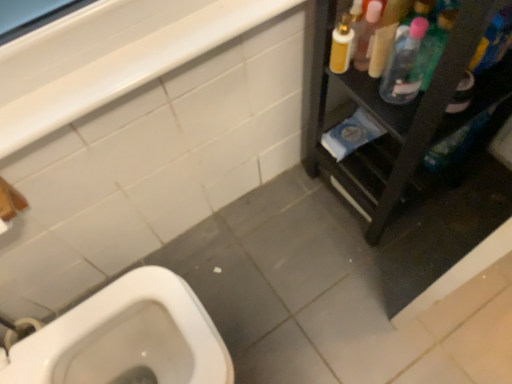
Image resolution: width=512 pixels, height=384 pixels. I want to click on white glossy balustrade at upper left, so click(x=129, y=69).

The height and width of the screenshot is (384, 512). What do you see at coordinates (405, 117) in the screenshot? I see `black plastic shelf at right` at bounding box center [405, 117].

This screenshot has width=512, height=384. I want to click on clear plastic bottle at upper right, acting as the second cleaning product starting from the right, so click(x=405, y=65).

Image resolution: width=512 pixels, height=384 pixels. I want to click on white glossy balustrade at upper left, so click(x=129, y=69).

Find the location of a particular element. furniture that is under the white glossy balustrade at upper left (from a real-world perspective) is located at coordinates (405, 117).

From a real-world perspective, is white glossy balustrade at upper left physically below black plastic shelf at right?

No, from a real-world perspective, white glossy balustrade at upper left is not beneath black plastic shelf at right.

Which is closer, [146,45] or [353,155]?

Point [146,45] appears to be closer to the viewer than point [353,155].

Considering the relative sizes of white glossy balustrade at upper left and black plastic shelf at right in the image provided, is white glossy balustrade at upper left bigger than black plastic shelf at right?

Actually, white glossy balustrade at upper left might be smaller than black plastic shelf at right.

Considering the sizes of white glossy balustrade at upper left and clear plastic bottle at upper right, acting as the second cleaning product starting from the right, in the image, is white glossy balustrade at upper left taller or shorter than clear plastic bottle at upper right, acting as the second cleaning product starting from the right,?

white glossy balustrade at upper left is shorter than clear plastic bottle at upper right, acting as the second cleaning product starting from the right.

In the scene shown: Is white glossy balustrade at upper left with clear plastic bottle at upper right, placed as the first cleaning product when sorted from left to right?

white glossy balustrade at upper left and clear plastic bottle at upper right, placed as the first cleaning product when sorted from left to right, are not in contact.

Does point (184, 51) appear closer or farther from the camera than point (416, 73)?

Point (184, 51) is closer to the camera than point (416, 73).

The height and width of the screenshot is (384, 512). Identify the location of balustrade located on the left of clear plastic bottle at upper right, acting as the second cleaning product starting from the right. (129, 69).

In the scene shown: Which is more to the right, translucent plastic spray bottle at upper right, which is the first cleaning product from right to left, or clear plastic bottle at upper right, acting as the second cleaning product starting from the right?

translucent plastic spray bottle at upper right, which is the first cleaning product from right to left.

In the image, is translucent plastic spray bottle at upper right, which is the first cleaning product from right to left, positioned in front of or behind clear plastic bottle at upper right, placed as the first cleaning product when sorted from left to right?

translucent plastic spray bottle at upper right, which is the first cleaning product from right to left, is positioned closer to the viewer than clear plastic bottle at upper right, placed as the first cleaning product when sorted from left to right.

In the scene shown: Between translucent plastic spray bottle at upper right, placed as the 2th cleaning product when sorted from left to right, and clear plastic bottle at upper right, acting as the second cleaning product starting from the right, which one has smaller size?

Smaller between the two is clear plastic bottle at upper right, acting as the second cleaning product starting from the right.

Is point (344, 194) less distant than point (158, 69)?

That is False.

Which object is thinner, black plastic shelf at right or white glossy balustrade at upper left?

With smaller width is white glossy balustrade at upper left.

Between black plastic shelf at right and white glossy balustrade at upper left, which one has smaller size?

white glossy balustrade at upper left.

Relative to white glossy balustrade at upper left, is black plastic shelf at right in front or behind?

In the image, black plastic shelf at right appears in front of white glossy balustrade at upper left.

Which is closer, (424, 22) or (6, 140)?

The point (6, 140) is in front.

You are a GUI agent. You are given a task and a screenshot of the screen. Output one action in this format:
    pyautogui.click(x=<x>, y=<y>)
    Task: Click on the balustrade in front of the clear plastic bottle at upper right, acting as the second cleaning product starting from the right
    This screenshot has width=512, height=384.
    Given the screenshot: What is the action you would take?
    pyautogui.click(x=129, y=69)

Can we say clear plastic bottle at upper right, acting as the second cleaning product starting from the right, lies outside black plastic shelf at right?

Actually, clear plastic bottle at upper right, acting as the second cleaning product starting from the right, is at least partially inside black plastic shelf at right.

Consider the image. Considering the positions of objects clear plastic bottle at upper right, placed as the first cleaning product when sorted from left to right, and black plastic shelf at right in the image provided, who is behind, clear plastic bottle at upper right, placed as the first cleaning product when sorted from left to right, or black plastic shelf at right?

clear plastic bottle at upper right, placed as the first cleaning product when sorted from left to right, is further from the camera.

Can you confirm if clear plastic bottle at upper right, acting as the second cleaning product starting from the right, is positioned to the left of black plastic shelf at right?

Correct, you'll find clear plastic bottle at upper right, acting as the second cleaning product starting from the right, to the left of black plastic shelf at right.

Is clear plastic bottle at upper right, placed as the first cleaning product when sorted from left to right, looking in the opposite direction of black plastic shelf at right?

Absolutely, clear plastic bottle at upper right, placed as the first cleaning product when sorted from left to right, is directed away from black plastic shelf at right.

How many degrees apart are the facing directions of translucent plastic spray bottle at upper right, which is the first cleaning product from right to left, and black plastic shelf at right?

The facing directions of translucent plastic spray bottle at upper right, which is the first cleaning product from right to left, and black plastic shelf at right are 87.9 degrees apart.

Can you confirm if translucent plastic spray bottle at upper right, placed as the 2th cleaning product when sorted from left to right, is positioned to the left of black plastic shelf at right?

Yes, translucent plastic spray bottle at upper right, placed as the 2th cleaning product when sorted from left to right, is to the left of black plastic shelf at right.

Is translucent plastic spray bottle at upper right, placed as the 2th cleaning product when sorted from left to right, inside the boundaries of black plastic shelf at right, or outside?

The correct answer is: inside.

Between translucent plastic spray bottle at upper right, which is the first cleaning product from right to left, and black plastic shelf at right, which one has larger size?

With larger size is black plastic shelf at right.

The height and width of the screenshot is (384, 512). What are the coordinates of `balustrade above the black plastic shelf at right (from a real-world perspective)` in the screenshot? It's located at (129, 69).

From the white glossy balustrade at upper left, count 1st cleaning product to the right and point to it. Please provide its 2D coordinates.

[(405, 65)]

Estimate the real-world distances between objects in this image. Which object is closer to translucent plastic spray bottle at upper right, placed as the 2th cleaning product when sorted from left to right, clear plastic bottle at upper right, acting as the second cleaning product starting from the right, or white glossy balustrade at upper left?

clear plastic bottle at upper right, acting as the second cleaning product starting from the right, is positioned closer to the anchor translucent plastic spray bottle at upper right, placed as the 2th cleaning product when sorted from left to right.

When comparing their distances from black plastic shelf at right, does clear plastic bottle at upper right, acting as the second cleaning product starting from the right, or white glossy balustrade at upper left seem closer?

clear plastic bottle at upper right, acting as the second cleaning product starting from the right, is closer to black plastic shelf at right.

Estimate the real-world distances between objects in this image. Which object is closer to white glossy balustrade at upper left, clear plastic bottle at upper right, placed as the first cleaning product when sorted from left to right, or translucent plastic spray bottle at upper right, which is the first cleaning product from right to left?

The object closer to white glossy balustrade at upper left is clear plastic bottle at upper right, placed as the first cleaning product when sorted from left to right.

Based on their spatial positions, is black plastic shelf at right or white glossy balustrade at upper left closer to clear plastic bottle at upper right, acting as the second cleaning product starting from the right?

The object closer to clear plastic bottle at upper right, acting as the second cleaning product starting from the right, is black plastic shelf at right.

Which object lies further to the anchor point translucent plastic spray bottle at upper right, placed as the 2th cleaning product when sorted from left to right, white glossy balustrade at upper left or clear plastic bottle at upper right, acting as the second cleaning product starting from the right?

white glossy balustrade at upper left is further to translucent plastic spray bottle at upper right, placed as the 2th cleaning product when sorted from left to right.

From the picture: Considering their positions, is translucent plastic spray bottle at upper right, which is the first cleaning product from right to left, positioned closer to white glossy balustrade at upper left than black plastic shelf at right?

black plastic shelf at right lies closer to white glossy balustrade at upper left than the other object.

Which object lies nearer to the anchor point black plastic shelf at right, white glossy balustrade at upper left or clear plastic bottle at upper right, placed as the first cleaning product when sorted from left to right?

Among the two, clear plastic bottle at upper right, placed as the first cleaning product when sorted from left to right, is located nearer to black plastic shelf at right.

When comparing their distances from white glossy balustrade at upper left, does black plastic shelf at right or translucent plastic spray bottle at upper right, placed as the 2th cleaning product when sorted from left to right, seem further?

translucent plastic spray bottle at upper right, placed as the 2th cleaning product when sorted from left to right, is further to white glossy balustrade at upper left.

I want to click on cleaning product between white glossy balustrade at upper left and translucent plastic spray bottle at upper right, placed as the 2th cleaning product when sorted from left to right, in the horizontal direction, so click(405, 65).

Identify the location of cleaning product located between black plastic shelf at right and clear plastic bottle at upper right, placed as the first cleaning product when sorted from left to right, in the depth direction. (437, 40).